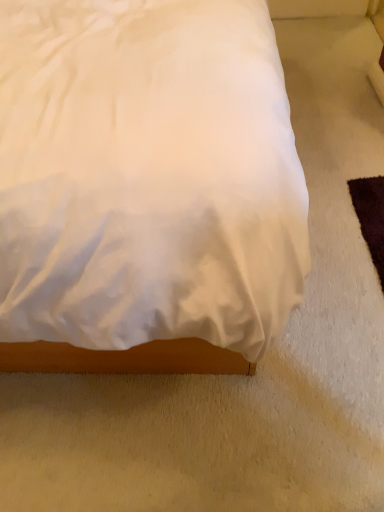
At what (x,y) coordinates should I click in order to perform the action: click on white satin bed at center. Please return your answer as a coordinate pair (x, y). This screenshot has height=512, width=384. Looking at the image, I should click on (147, 175).

What do you see at coordinates (147, 175) in the screenshot?
I see `white satin bed at center` at bounding box center [147, 175].

Identify the location of white satin bed at center. (147, 175).